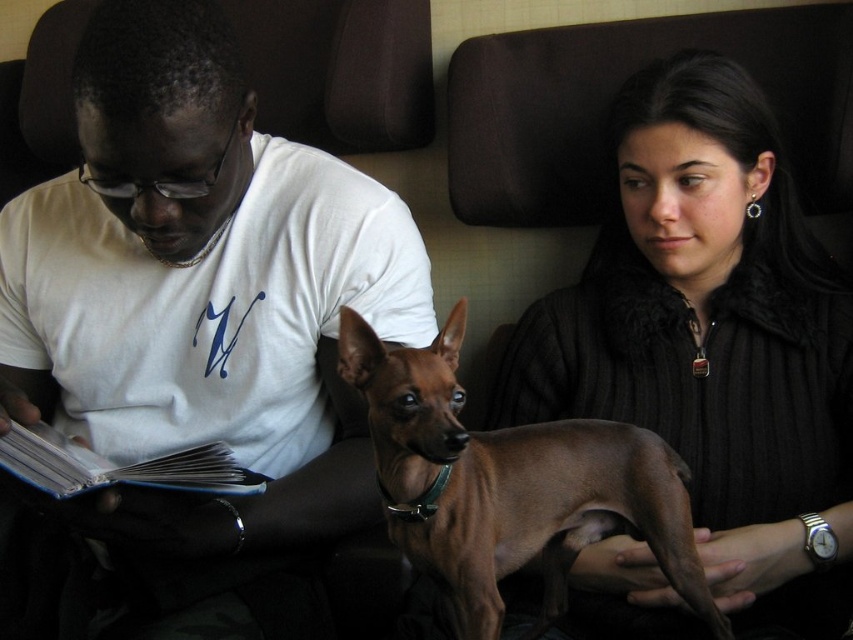
Question: Among these points, which one is nearest to the camera?

Choices:
 (A) (183, 531)
 (B) (451, 472)

Answer: (B)

Question: Is smooth black coat at center above brown shiny dog at center?

Choices:
 (A) yes
 (B) no

Answer: (A)

Question: In this image, where is matte white shirt at center located relative to blue hardcover book at left?

Choices:
 (A) left
 (B) right

Answer: (B)

Question: Estimate the real-world distances between objects in this image. Which object is closer to the brown shiny dog at center?

Choices:
 (A) matte white shirt at center
 (B) blue hardcover book at left
 (C) smooth black coat at center

Answer: (C)

Question: Among these objects, which one is farthest from the camera?

Choices:
 (A) smooth black coat at center
 (B) matte white shirt at center
 (C) blue hardcover book at left

Answer: (A)

Question: Where is brown shiny dog at center located in relation to blue hardcover book at left in the image?

Choices:
 (A) above
 (B) below

Answer: (B)